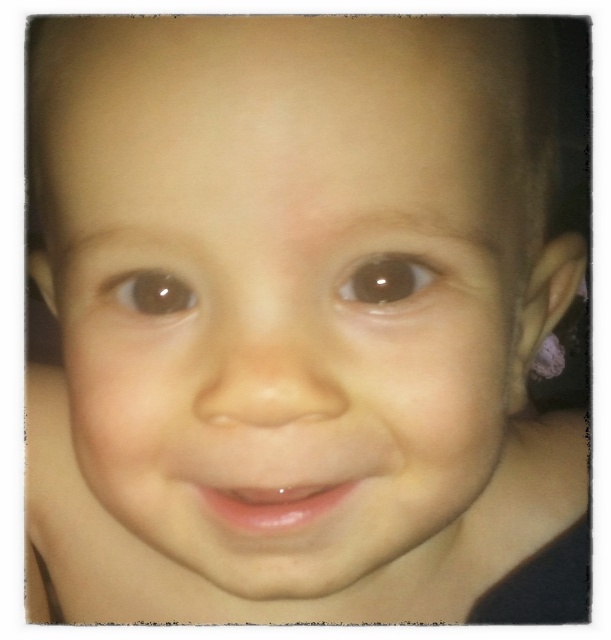
Based on the photo, you are a photographer adjusting the focus on your camera. You notice two points in the image at coordinates point (381, 260) and point (145, 298). Which point should you focus on to ensure the child is in sharp focus?

Point (381, 260) is in front of point (145, 298), so focusing on point (381, 260) will ensure the child is in sharp focus since it is closer to the camera.

Based on the coordinates provided in the scene description, can you determine the exact location of the brown glossy eye at center?

The brown glossy eye at center is located at coordinates point (x=387, y=282).